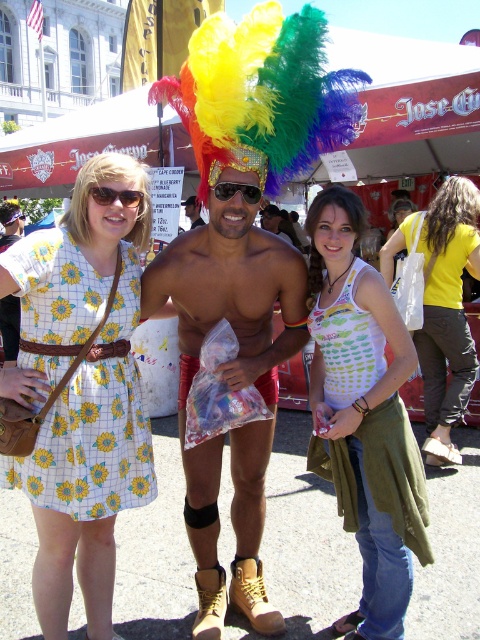
Question: Which point appears closest to the camera in this image?

Choices:
 (A) tap(432, 236)
 (B) tap(254, 193)
 (C) tap(363, 384)
 (D) tap(193, 216)

Answer: (C)

Question: Can you confirm if shiny metallic boots at center is positioned below rainbow feather headdress at center?

Choices:
 (A) yes
 (B) no

Answer: (A)

Question: Can you confirm if yellow sunflower dress at left is positioned below white canvas tote bag at center?

Choices:
 (A) no
 (B) yes

Answer: (B)

Question: Among these objects, which one is nearest to the camera?

Choices:
 (A) white printed tank top at center
 (B) matte brown sunglasses at center

Answer: (A)

Question: Which point is closer to the camera?

Choices:
 (A) (421, 371)
 (B) (120, 196)

Answer: (B)

Question: Is the position of shiny metallic boots at center less distant than that of sunglasses at center?

Choices:
 (A) no
 (B) yes

Answer: (B)